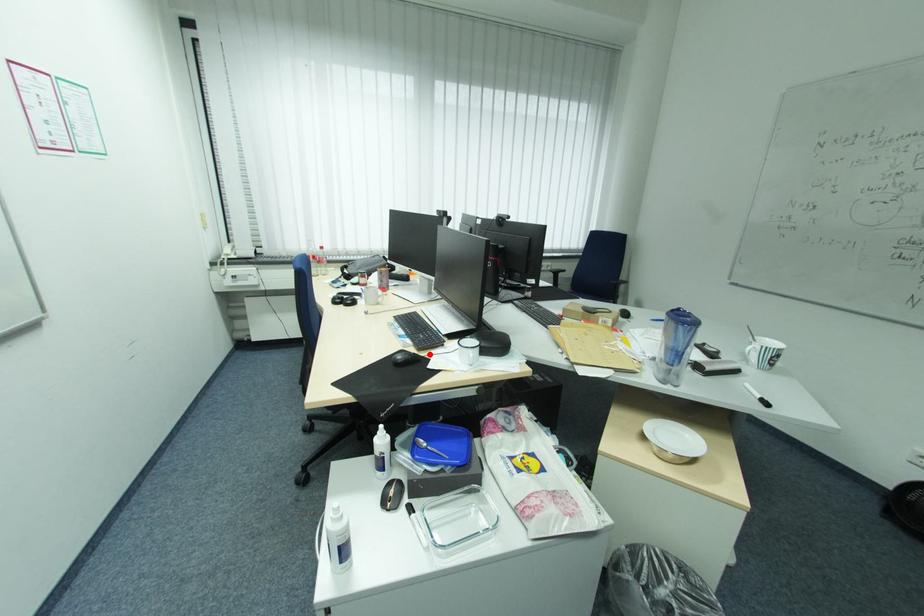
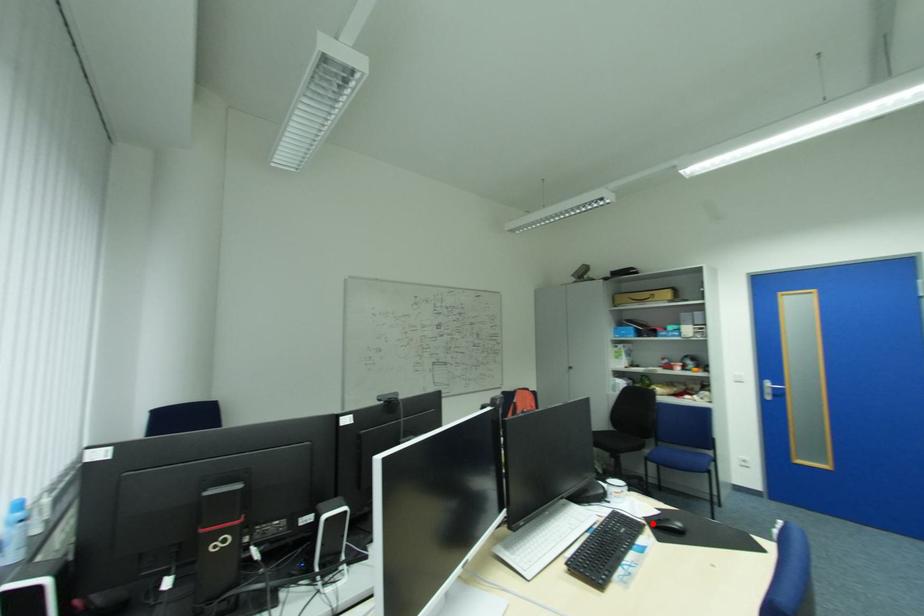
I am providing you with two images of the same scene from different viewpoints. A red point is marked on the first image and another point is marked on the second image. Do the highlighted points in image1 and image2 indicate the same real-world spot?

Yes